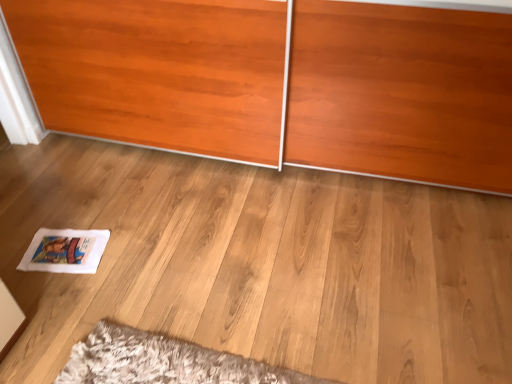
This screenshot has height=384, width=512. I want to click on vacant space situated above white paper magazine at lower left (from a real-world perspective), so click(61, 254).